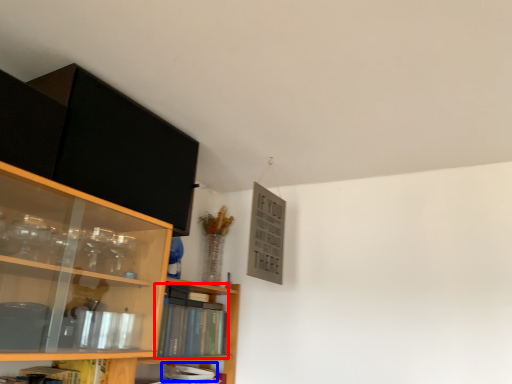
Question: Which of the following is the closest to the observer, book (highlighted by a red box) or book (highlighted by a blue box)?

Choices:
 (A) book
 (B) book

Answer: (A)